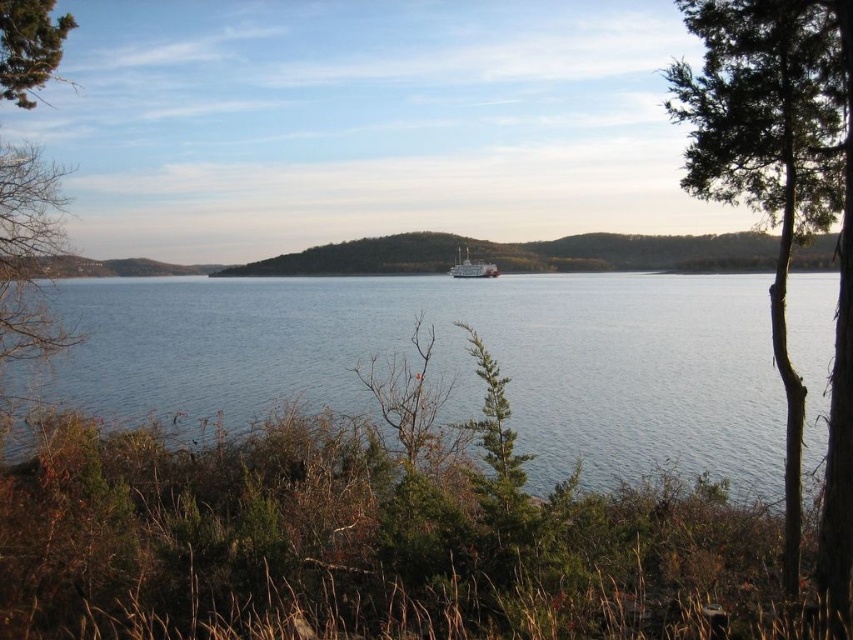
Can you confirm if green leafy tree at right is thinner than white matte boat at center?

No.

Does green leafy tree at right appear under white matte boat at center?

Correct, green leafy tree at right is located below white matte boat at center.

Is point (825, 4) less distant than point (468, 266)?

Yes.

In order to click on green leafy tree at right in this screenshot , I will do `click(782, 193)`.

Which is below, green leafy tree at upper left or white matte boat at center?

white matte boat at center is lower down.

Who is more forward, (53, 51) or (494, 268)?

Point (53, 51)

Find the location of `green leafy tree at upper left`. green leafy tree at upper left is located at coordinates (28, 48).

Does blue water at center have a smaller size compared to white matte boat at center?

No.

Does point (758, 380) lie behind point (466, 253)?

No.

Between point (604, 404) and point (467, 248), which one is positioned in front?

Point (604, 404) is in front.

The image size is (853, 640). Identify the location of blue water at center. (450, 360).